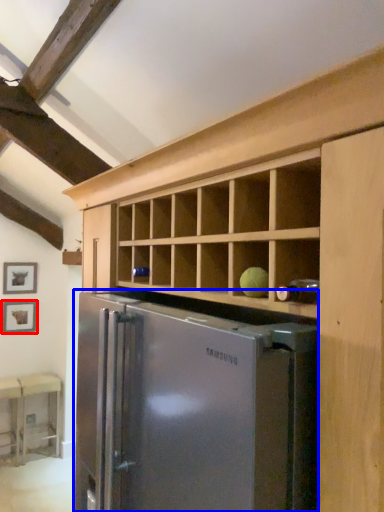
Question: Which object is closer to the camera taking this photo, picture frame (highlighted by a red box) or refrigerator (highlighted by a blue box)?

Choices:
 (A) picture frame
 (B) refrigerator

Answer: (B)